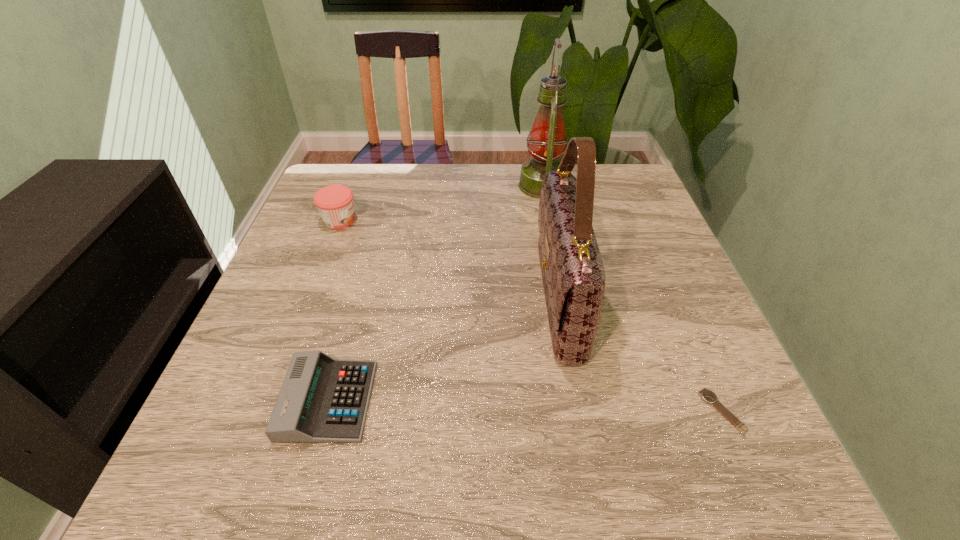
This screenshot has height=540, width=960. What are the coordinates of `free location that satisfies the following two spatial constraints: 1. on the front of the handbag with the clasp; 2. on the left side of the shortest object` in the screenshot? It's located at pos(578,411).

Locate an element on the screen. The image size is (960, 540). free space that satisfies the following two spatial constraints: 1. on the back side of the calculator; 2. on the left side of the farthest object is located at coordinates (388, 186).

Find the location of a particular element. The width and height of the screenshot is (960, 540). vacant area that satisfies the following two spatial constraints: 1. on the back side of the fourth tallest object; 2. on the front label of the second farthest object is located at coordinates (378, 220).

I want to click on vacant position in the image that satisfies the following two spatial constraints: 1. on the front label of the jam; 2. on the right side of the second shortest object, so click(x=271, y=401).

The width and height of the screenshot is (960, 540). What are the coordinates of `vacant space that satisfies the following two spatial constraints: 1. on the front label of the third shortest object; 2. on the back side of the watch` in the screenshot? It's located at coord(267,411).

The image size is (960, 540). I want to click on free space in the image that satisfies the following two spatial constraints: 1. on the front of the handbag with the clasp; 2. on the back side of the watch, so click(x=578, y=411).